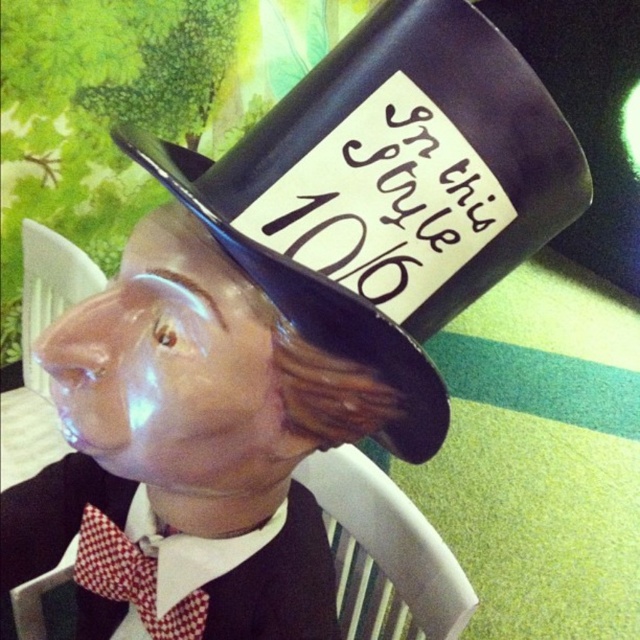
Question: Which of the following is the closest to the observer?

Choices:
 (A) red checkered fabric tie at center
 (B) black glossy top hat at center

Answer: (B)

Question: Is the position of black glossy top hat at center less distant than that of red checkered fabric tie at center?

Choices:
 (A) yes
 (B) no

Answer: (A)

Question: Which object is farther from the camera taking this photo?

Choices:
 (A) red checkered fabric tie at center
 (B) black glossy top hat at center

Answer: (A)

Question: Observing the image, what is the correct spatial positioning of black glossy top hat at center in reference to red checkered fabric tie at center?

Choices:
 (A) above
 (B) below

Answer: (A)

Question: Is black glossy top hat at center to the left of red checkered fabric tie at center from the viewer's perspective?

Choices:
 (A) yes
 (B) no

Answer: (B)

Question: Which point is closer to the camera?

Choices:
 (A) (328, 323)
 (B) (188, 598)

Answer: (A)